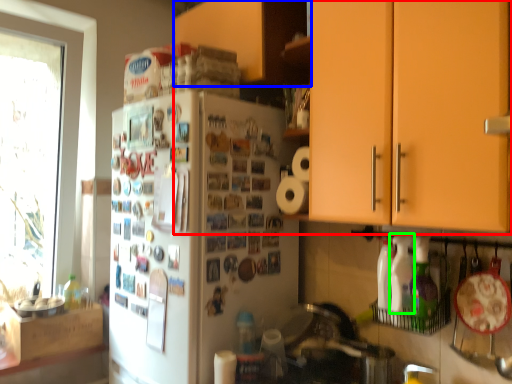
Question: Which object is positioned farthest from cabinetry (highlighted by a red box)? Select from cabinetry (highlighted by a blue box) and bottle (highlighted by a green box).

Choices:
 (A) cabinetry
 (B) bottle

Answer: (A)